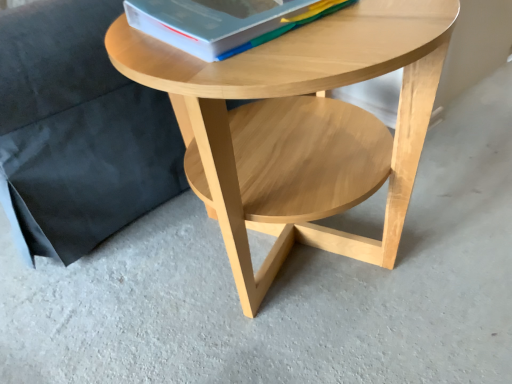
Where is `free region under natural wood coffee table at center (from a real-world perspective)`? free region under natural wood coffee table at center (from a real-world perspective) is located at coordinates click(x=300, y=268).